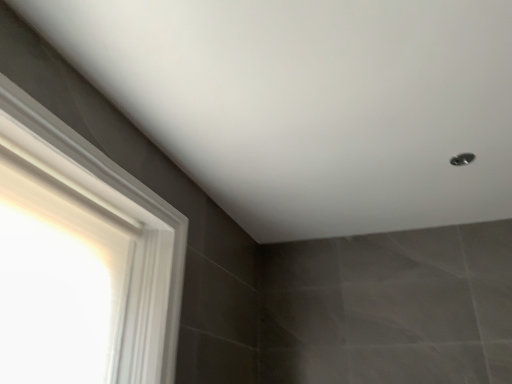
Question: Is metallic silver shower at upper right taller or shorter than white glossy frame at left?

Choices:
 (A) short
 (B) tall

Answer: (A)

Question: Based on their sizes in the image, would you say metallic silver shower at upper right is bigger or smaller than white glossy frame at left?

Choices:
 (A) big
 (B) small

Answer: (B)

Question: In the image, is metallic silver shower at upper right positioned in front of or behind white glossy frame at left?

Choices:
 (A) behind
 (B) front

Answer: (A)

Question: Is white glossy frame at left wider or thinner than metallic silver shower at upper right?

Choices:
 (A) wide
 (B) thin

Answer: (A)

Question: From a real-world perspective, is white glossy frame at left physically located above or below metallic silver shower at upper right?

Choices:
 (A) above
 (B) below

Answer: (B)

Question: Is point (111, 246) closer or farther from the camera than point (459, 162)?

Choices:
 (A) closer
 (B) farther

Answer: (A)

Question: Is white glossy frame at left in front of or behind metallic silver shower at upper right in the image?

Choices:
 (A) front
 (B) behind

Answer: (A)